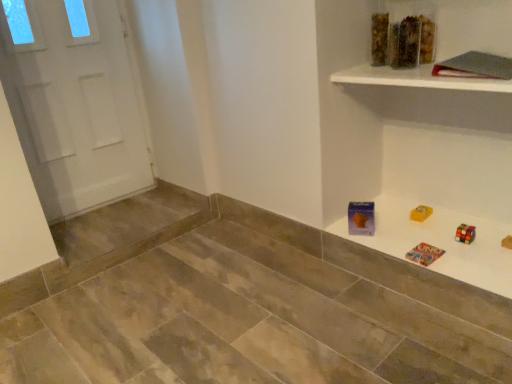
Describe the element at coordinates (417, 79) in the screenshot. The width and height of the screenshot is (512, 384). I see `white glossy shelf at upper right` at that location.

What do you see at coordinates (405, 43) in the screenshot?
I see `translucent plastic container at upper right, positioned as the 2th toy in right-to-left order` at bounding box center [405, 43].

Image resolution: width=512 pixels, height=384 pixels. Find the location of `translucent plastic container at upper right, which is the first toy in right-to-left order`. translucent plastic container at upper right, which is the first toy in right-to-left order is located at coordinates (402, 41).

Locate an element on the screen. Image resolution: width=512 pixels, height=384 pixels. translucent plastic container at upper center is located at coordinates (379, 39).

Can you confirm if white glossy shelf at upper right is shorter than white glossy door at left?

Yes.

This screenshot has width=512, height=384. Identify the location of shelf that is in front of the white glossy door at left. (417, 79).

From a real-world perspective, which object rests below the other?

From a 3D spatial view, white glossy door at left is below.

Is the position of white glossy shelf at upper right more distant than that of white glossy door at left?

No, it is not.

Find the location of a particular element. Image resolution: width=512 pixels, height=384 pixels. door located on the left of white glossy shelf at upper right is located at coordinates (78, 107).

Which is in front, white glossy door at left or white glossy shelf at upper right?

white glossy shelf at upper right.

Between white glossy door at left and white glossy shelf at upper right, which one has smaller size?

Smaller between the two is white glossy shelf at upper right.

From a real-world perspective, is white glossy door at left above or below white glossy shelf at upper right?

white glossy door at left is situated lower than white glossy shelf at upper right in the real world.

From their relative heights in the image, would you say translucent plastic container at upper right, positioned as the 2th toy in right-to-left order, is taller or shorter than white glossy door at left?

Clearly, translucent plastic container at upper right, positioned as the 2th toy in right-to-left order, is shorter compared to white glossy door at left.

Between translucent plastic container at upper right, which appears as the 1th toy when viewed from the left, and white glossy door at left, which one appears on the left side from the viewer's perspective?

white glossy door at left.

From the image's perspective, does translucent plastic container at upper right, which appears as the 1th toy when viewed from the left, appear lower than white glossy door at left?

Incorrect, from the image's perspective, translucent plastic container at upper right, which appears as the 1th toy when viewed from the left, is higher than white glossy door at left.

Who is bigger, translucent plastic container at upper right, positioned as the 2th toy in right-to-left order, or white glossy door at left?

white glossy door at left is bigger.

From a real-world perspective, is multicolored plastic puzzle at upper right over translucent plastic container at upper right, the 2th toy when ordered from left to right?

No, from a real-world perspective, multicolored plastic puzzle at upper right is not above translucent plastic container at upper right, the 2th toy when ordered from left to right.

Does multicolored plastic puzzle at upper right come behind translucent plastic container at upper right, the 2th toy when ordered from left to right?

No, the depth of multicolored plastic puzzle at upper right is less than that of translucent plastic container at upper right, the 2th toy when ordered from left to right.

Can you tell me how much multicolored plastic puzzle at upper right and translucent plastic container at upper right, the 2th toy when ordered from left to right, differ in facing direction?

The facing directions of multicolored plastic puzzle at upper right and translucent plastic container at upper right, the 2th toy when ordered from left to right, are 0.896 degrees apart.

Is multicolored plastic puzzle at upper right facing away from translucent plastic container at upper right, the 2th toy when ordered from left to right?

multicolored plastic puzzle at upper right does not have its back to translucent plastic container at upper right, the 2th toy when ordered from left to right.

Could you tell me if translucent plastic container at upper center is facing translucent plastic container at upper right, the 2th toy when ordered from left to right?

No.

Considering the sizes of objects translucent plastic container at upper center and translucent plastic container at upper right, which is the first toy in right-to-left order, in the image provided, who is bigger, translucent plastic container at upper center or translucent plastic container at upper right, which is the first toy in right-to-left order,?

Bigger between the two is translucent plastic container at upper right, which is the first toy in right-to-left order.

From a real-world perspective, is translucent plastic container at upper center physically located above or below translucent plastic container at upper right, which is the first toy in right-to-left order?

translucent plastic container at upper center is above translucent plastic container at upper right, which is the first toy in right-to-left order.

Does translucent plastic container at upper center touch translucent plastic container at upper right, which is the first toy in right-to-left order?

Yes, translucent plastic container at upper center is touching translucent plastic container at upper right, which is the first toy in right-to-left order.

Can you confirm if translucent plastic container at upper center is taller than translucent plastic container at upper right, positioned as the 2th toy in right-to-left order?

Yes.

From a real-world perspective, is translucent plastic container at upper center on translucent plastic container at upper right, positioned as the 2th toy in right-to-left order?

Actually, translucent plastic container at upper center is physically below translucent plastic container at upper right, positioned as the 2th toy in right-to-left order, in the real world.

Is translucent plastic container at upper center to the left of translucent plastic container at upper right, positioned as the 2th toy in right-to-left order, from the viewer's perspective?

Yes, translucent plastic container at upper center is to the left of translucent plastic container at upper right, positioned as the 2th toy in right-to-left order.

From the image's perspective, between translucent plastic container at upper center and translucent plastic container at upper right, positioned as the 2th toy in right-to-left order, who is located below?

translucent plastic container at upper right, positioned as the 2th toy in right-to-left order, appears lower in the image.

Where is `the 2nd toy counting from the left side of the white glossy shelf at upper right`? The width and height of the screenshot is (512, 384). the 2nd toy counting from the left side of the white glossy shelf at upper right is located at coordinates (405, 43).

Between white glossy shelf at upper right and translucent plastic container at upper right, positioned as the 2th toy in right-to-left order, which one has smaller width?

With smaller width is translucent plastic container at upper right, positioned as the 2th toy in right-to-left order.

From a real-world perspective, is white glossy shelf at upper right on translucent plastic container at upper right, which appears as the 1th toy when viewed from the left?

No, from a real-world perspective, white glossy shelf at upper right is not over translucent plastic container at upper right, which appears as the 1th toy when viewed from the left

Based on the photo, from the image's perspective, between white glossy shelf at upper right and translucent plastic container at upper right, which appears as the 1th toy when viewed from the left, who is located below?

white glossy shelf at upper right is shown below in the image.

You are a GUI agent. You are given a task and a screenshot of the screen. Output one action in this format:
    pyautogui.click(x=<x>, y=<y>)
    Task: Click on the shelf below the white glossy door at left (from the image's perspective)
    This screenshot has height=384, width=512.
    Given the screenshot: What is the action you would take?
    pyautogui.click(x=417, y=79)

Locate an element on the screen. door that appears behind the white glossy shelf at upper right is located at coordinates (78, 107).

When comparing their distances from multicolored plastic puzzle at upper right, does translucent plastic container at upper center or translucent plastic container at upper right, which appears as the 1th toy when viewed from the left, seem further?

translucent plastic container at upper center lies further to multicolored plastic puzzle at upper right than the other object.

Estimate the real-world distances between objects in this image. Which object is further from white glossy shelf at upper right, white glossy door at left or translucent plastic container at upper right, the 2th toy when ordered from left to right?

white glossy door at left lies further to white glossy shelf at upper right than the other object.

Based on the photo, estimate the real-world distances between objects in this image. Which object is further from white glossy shelf at upper right, translucent plastic container at upper right, which is the first toy in right-to-left order, or translucent plastic container at upper center?

translucent plastic container at upper center.

Which object lies further to the anchor point white glossy shelf at upper right, translucent plastic container at upper right, positioned as the 2th toy in right-to-left order, or translucent plastic container at upper center?

translucent plastic container at upper center is further to white glossy shelf at upper right.

Which object lies nearer to the anchor point translucent plastic container at upper right, which is the first toy in right-to-left order, white glossy shelf at upper right or white glossy door at left?

Among the two, white glossy shelf at upper right is located nearer to translucent plastic container at upper right, which is the first toy in right-to-left order.

Looking at this image, estimate the real-world distances between objects in this image. Which object is closer to translucent plastic container at upper right, the 2th toy when ordered from left to right, multicolored plastic puzzle at upper right or translucent plastic container at upper center?

translucent plastic container at upper center is positioned closer to the anchor translucent plastic container at upper right, the 2th toy when ordered from left to right.

Considering their positions, is translucent plastic container at upper center positioned closer to translucent plastic container at upper right, positioned as the 2th toy in right-to-left order, than translucent plastic container at upper right, which is the first toy in right-to-left order?

translucent plastic container at upper right, which is the first toy in right-to-left order.

When comparing their distances from translucent plastic container at upper right, the 2th toy when ordered from left to right, does translucent plastic container at upper right, which appears as the 1th toy when viewed from the left, or multicolored plastic puzzle at upper right seem closer?

translucent plastic container at upper right, which appears as the 1th toy when viewed from the left, is positioned closer to the anchor translucent plastic container at upper right, the 2th toy when ordered from left to right.

The width and height of the screenshot is (512, 384). Find the location of `shelf situated between white glossy door at left and multicolored plastic puzzle at upper right from left to right`. shelf situated between white glossy door at left and multicolored plastic puzzle at upper right from left to right is located at coordinates (417, 79).

Where is `toy located between translucent plastic container at upper center and translucent plastic container at upper right, which is the first toy in right-to-left order, in the left-right direction`? toy located between translucent plastic container at upper center and translucent plastic container at upper right, which is the first toy in right-to-left order, in the left-right direction is located at coordinates (405, 43).

Image resolution: width=512 pixels, height=384 pixels. I want to click on toy between white glossy door at left and translucent plastic container at upper right, the 2th toy when ordered from left to right, so click(405, 43).

At what (x,y) coordinates should I click in order to perform the action: click on toy between white glossy shelf at upper right and translucent plastic container at upper right, the 2th toy when ordered from left to right, in the front-back direction. Please return your answer as a coordinate pair (x, y). Looking at the image, I should click on (405, 43).